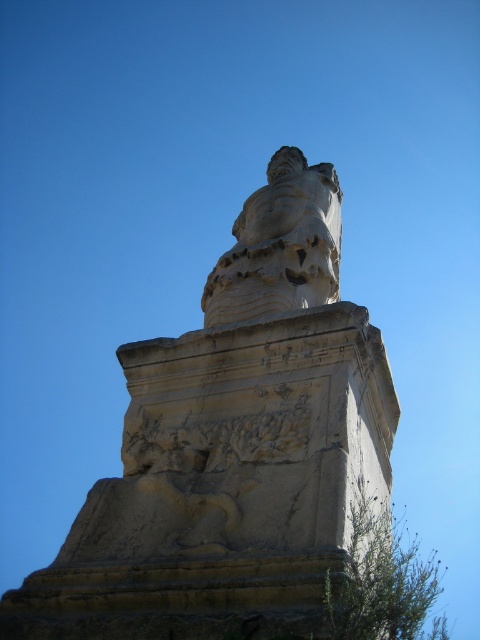
You are standing in front of the monument and want to locate the point at coordinates (233, 445). Based on the description, where would this point be located on the monument?

The point at coordinates (233, 445) is on the white stone statue at center.

From the picture: You are standing in front of the monument and want to take a photo of the white stone statue at center. If your camera can focus on objects up to 30 meters away, will you be able to capture a clear image?

The white stone statue at center is 35.91 meters from viewer, which is beyond the camera focus range of 30 meters. Therefore, the camera cannot capture a clear image of the statue.